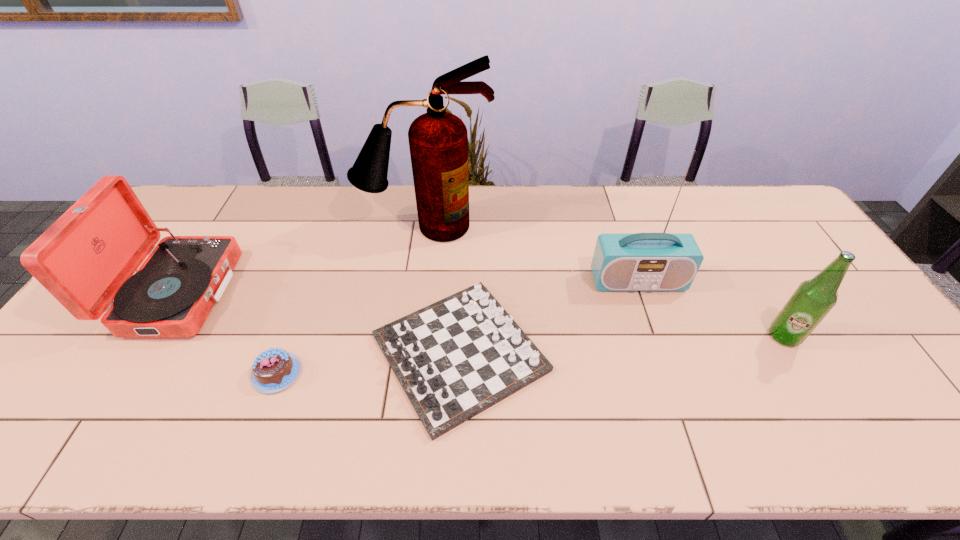
Locate an element on the screen. This screenshot has height=540, width=960. vacant space at the right edge is located at coordinates (773, 235).

Locate an element on the screen. The height and width of the screenshot is (540, 960). vacant area at the near left corner of the desktop is located at coordinates (23, 426).

At what (x,y) coordinates should I click in order to perform the action: click on free space between the fifth object from left to right and the fire extinguisher. Please return your answer as a coordinate pair (x, y). Looking at the image, I should click on (532, 254).

Find the location of `vacant area between the chocolate cake and the farthest object`. vacant area between the chocolate cake and the farthest object is located at coordinates (351, 300).

Identify the location of free spot between the farthest object and the chocolate cake. The image size is (960, 540). (351, 300).

I want to click on vacant area that lies between the chocolate cake and the chessboard, so click(x=369, y=363).

At what (x,y) coordinates should I click in order to perform the action: click on vacant space that's between the chessboard and the fifth shortest object. Please return your answer as a coordinate pair (x, y). Image resolution: width=960 pixels, height=540 pixels. Looking at the image, I should click on (549, 317).

Where is `vacant area that lies between the rightmost object and the chessboard`? vacant area that lies between the rightmost object and the chessboard is located at coordinates (622, 345).

Image resolution: width=960 pixels, height=540 pixels. What are the coordinates of `free point between the chessboard and the second object from right to left` in the screenshot? It's located at (549, 317).

Locate an element on the screen. object that is the fourth closest to the beer bottle is located at coordinates (274, 370).